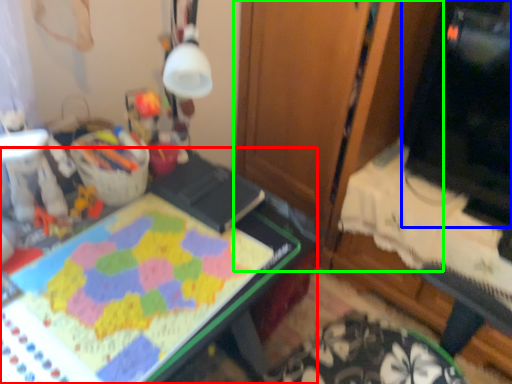
Question: Which object is positioned closest to desk (highlighted by a red box)? Select from computer monitor (highlighted by a blue box) and dresser (highlighted by a green box).

Choices:
 (A) computer monitor
 (B) dresser

Answer: (B)